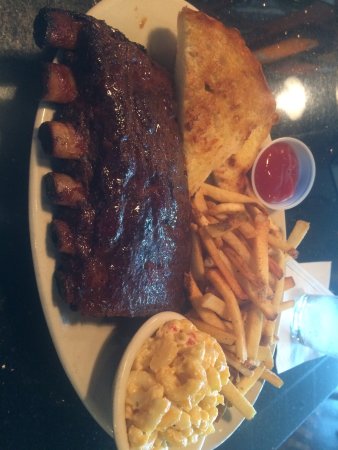
I want to click on lighting, so click(283, 96).